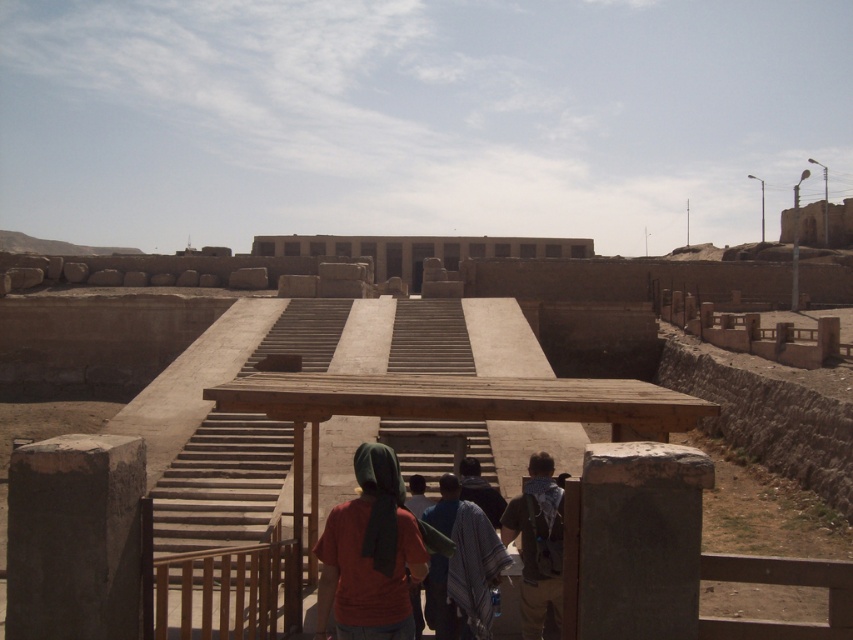
Question: Which point is closer to the camera?

Choices:
 (A) camouflage-patterned backpack at center
 (B) matte red shirt at center

Answer: (B)

Question: From the image, what is the correct spatial relationship of brown stone amphitheater at center in relation to matte red shirt at center?

Choices:
 (A) left
 (B) right

Answer: (A)

Question: Is brown stone amphitheater at center to the left of camouflage-patterned backpack at center from the viewer's perspective?

Choices:
 (A) yes
 (B) no

Answer: (A)

Question: Which point is closer to the camera?

Choices:
 (A) (165, 266)
 (B) (479, 522)
 (C) (546, 506)

Answer: (B)

Question: Which is farther from the camouflage-patterned backpack at center?

Choices:
 (A) matte red shirt at center
 (B) brown stone amphitheater at center

Answer: (B)

Question: Does brown stone amphitheater at center have a smaller size compared to matte red shirt at center?

Choices:
 (A) no
 (B) yes

Answer: (A)